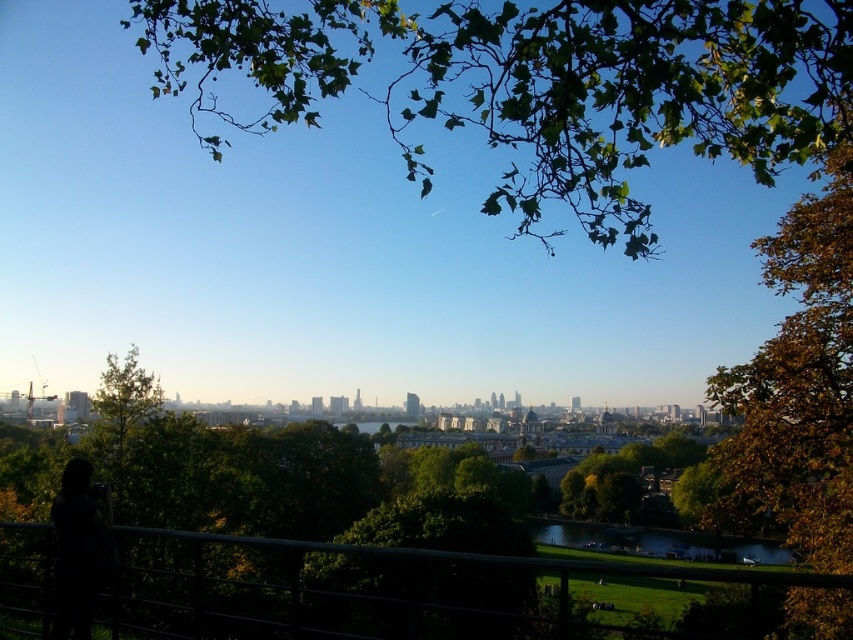
You are a tourist standing at the elevated viewpoint and want to take a photo that includes both the brown leafy tree at right and the black metal fence at lower center. Which object should you position closer to the front of your camera frame to ensure both are visible?

You should position the brown leafy tree at right closer to the front of your camera frame because the black metal fence at lower center is behind it, so moving the tree forward will keep both in view without one blocking the other.

You are standing at the elevated viewpoint looking at the cityscape. You see the green leafy branch at upper center and the brown leafy tree at right. Which object is closer to you based on their positions?

The green leafy branch at upper center is closer to you because it is positioned over the brown leafy tree at right, indicating it is in a higher plane in the visual field.